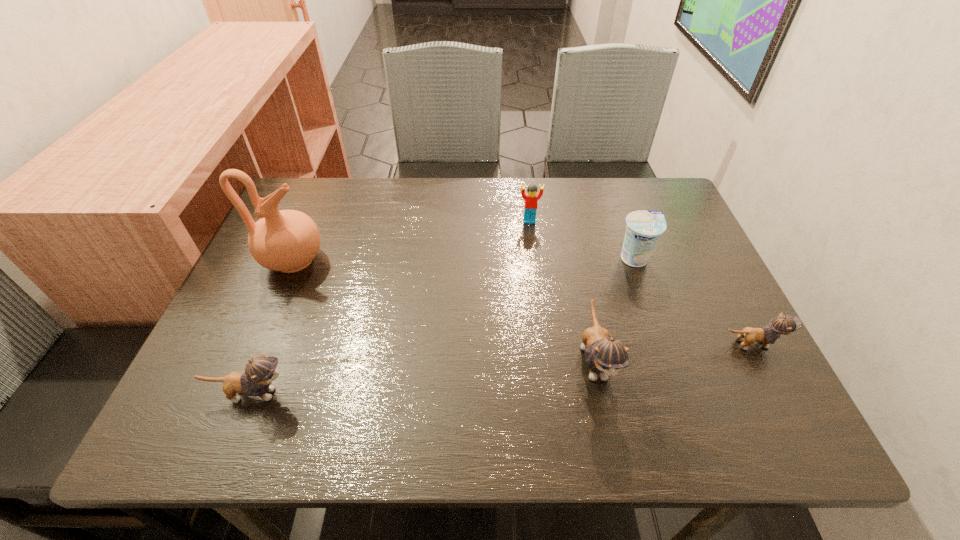
What are the coordinates of `the second shortest kitten` in the screenshot? It's located at (259, 373).

The image size is (960, 540). Find the location of `the third object from right to left`. the third object from right to left is located at coordinates (606, 356).

You are a GUI agent. You are given a task and a screenshot of the screen. Output one action in this format:
    pyautogui.click(x=<x>, y=<y>)
    Task: Click on the tallest kitten
    
    Given the screenshot: What is the action you would take?
    pos(606,356)

Find the location of a particular element. the rightmost object is located at coordinates (782, 324).

You are a GUI agent. You are given a task and a screenshot of the screen. Output one action in this format:
    pyautogui.click(x=<x>, y=<y>)
    Task: Click on the shortest object
    The width and height of the screenshot is (960, 540).
    Given the screenshot: What is the action you would take?
    (782, 324)

The image size is (960, 540). Find the location of `Lego`. Lego is located at coordinates (531, 198).

Identify the location of the farthest object. This screenshot has height=540, width=960. (531, 198).

You are a GUI agent. You are given a task and a screenshot of the screen. Output one action in this format:
    pyautogui.click(x=<x>, y=<y>)
    Task: Click on the pottery
    The height and width of the screenshot is (540, 960).
    Given the screenshot: What is the action you would take?
    pyautogui.click(x=287, y=240)

Locate an element on the screen. yogurt is located at coordinates (644, 227).

Locate an element on the screen. This screenshot has height=540, width=960. free space located on the front-facing side of the leftmost kitten is located at coordinates (441, 394).